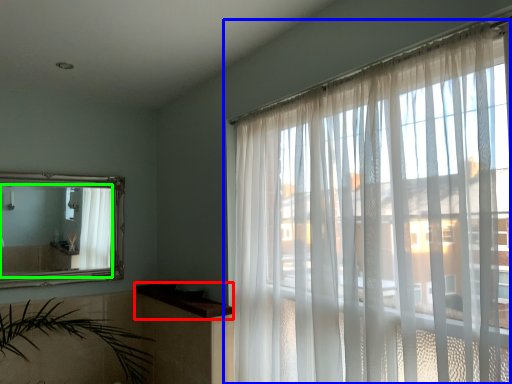
Question: Which is farther away from window sill (highlighted by a red box)? window (highlighted by a blue box) or mirror (highlighted by a green box)?

Choices:
 (A) window
 (B) mirror

Answer: (A)